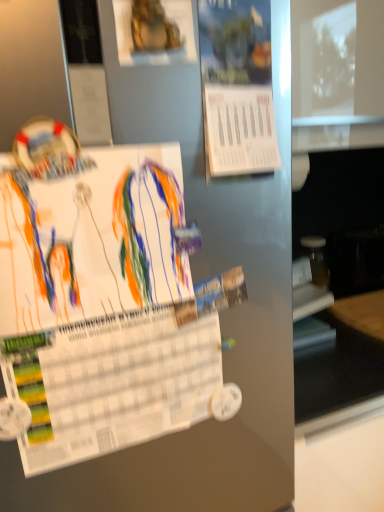
Question: Is blue paper at upper center, which appears as the 2th poster when viewed from the top, not within white paper at center, positioned as the 3th poster in top-to-bottom order?

Choices:
 (A) yes
 (B) no

Answer: (A)

Question: Is blue paper at upper center, which appears as the 2th poster when viewed from the top, placed right next to white paper at center, the 1th poster when ordered from bottom to top?

Choices:
 (A) yes
 (B) no

Answer: (B)

Question: From the image's perspective, is blue paper at upper center, which appears as the 2th poster when viewed from the top, under white paper at center, positioned as the 3th poster in top-to-bottom order?

Choices:
 (A) yes
 (B) no

Answer: (B)

Question: Is the depth of blue paper at upper center, marked as the 2th poster in a bottom-to-top arrangement, less than that of white paper at center, the 1th poster when ordered from bottom to top?

Choices:
 (A) no
 (B) yes

Answer: (A)

Question: Is blue paper at upper center, marked as the 2th poster in a bottom-to-top arrangement, smaller than white paper at center, positioned as the 3th poster in top-to-bottom order?

Choices:
 (A) yes
 (B) no

Answer: (A)

Question: In terms of height, does gold metallic statue at upper center, marked as the third poster in a bottom-to-top arrangement, look taller or shorter compared to blue paper at upper center, which appears as the 2th poster when viewed from the top?

Choices:
 (A) tall
 (B) short

Answer: (B)

Question: In terms of width, does gold metallic statue at upper center, the 1th poster positioned from the top, look wider or thinner when compared to blue paper at upper center, which appears as the 2th poster when viewed from the top?

Choices:
 (A) wide
 (B) thin

Answer: (B)

Question: Visually, is gold metallic statue at upper center, marked as the third poster in a bottom-to-top arrangement, positioned to the left or to the right of blue paper at upper center, which appears as the 2th poster when viewed from the top?

Choices:
 (A) right
 (B) left

Answer: (B)

Question: From a real-world perspective, relative to blue paper at upper center, marked as the 2th poster in a bottom-to-top arrangement, is gold metallic statue at upper center, marked as the third poster in a bottom-to-top arrangement, vertically above or below?

Choices:
 (A) above
 (B) below

Answer: (A)

Question: Is gold metallic statue at upper center, marked as the third poster in a bottom-to-top arrangement, taller or shorter than white paper at center, the 1th poster when ordered from bottom to top?

Choices:
 (A) short
 (B) tall

Answer: (A)

Question: Considering their positions, is gold metallic statue at upper center, the 1th poster positioned from the top, located in front of or behind white paper at center, positioned as the 3th poster in top-to-bottom order?

Choices:
 (A) front
 (B) behind

Answer: (B)

Question: Do you think gold metallic statue at upper center, marked as the third poster in a bottom-to-top arrangement, is within white paper at center, positioned as the 3th poster in top-to-bottom order, or outside of it?

Choices:
 (A) inside
 (B) outside

Answer: (B)

Question: Considering the relative positions of gold metallic statue at upper center, marked as the third poster in a bottom-to-top arrangement, and white paper at center, the 1th poster when ordered from bottom to top, in the image provided, is gold metallic statue at upper center, marked as the third poster in a bottom-to-top arrangement, to the left or to the right of white paper at center, the 1th poster when ordered from bottom to top,?

Choices:
 (A) left
 (B) right

Answer: (B)

Question: Is point (122, 180) closer or farther from the camera than point (142, 20)?

Choices:
 (A) closer
 (B) farther

Answer: (B)

Question: Is white paper at center, positioned as the 3th poster in top-to-bottom order, in front of or behind gold metallic statue at upper center, the 1th poster positioned from the top, in the image?

Choices:
 (A) behind
 (B) front

Answer: (B)